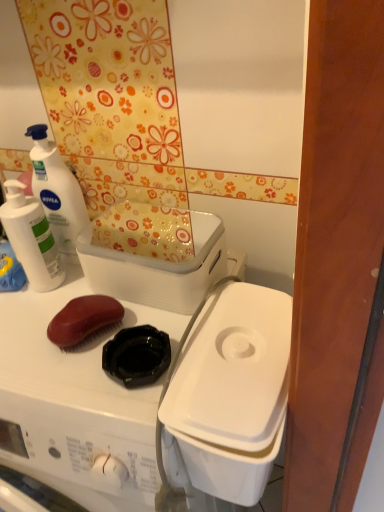
Identify the location of free space in front of white matte lotion at upper left, the first cleaning product from the left. The height and width of the screenshot is (512, 384). (38, 338).